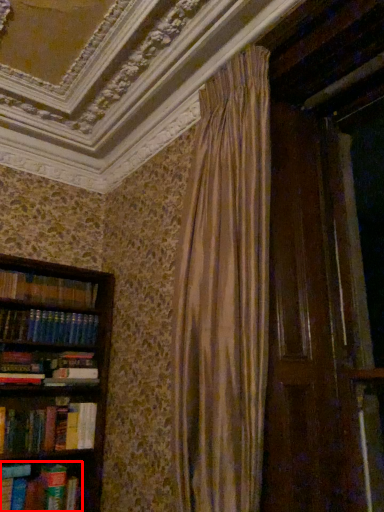
Question: In this image, where is book (annotated by the red box) located relative to paperback book?

Choices:
 (A) left
 (B) right

Answer: (A)